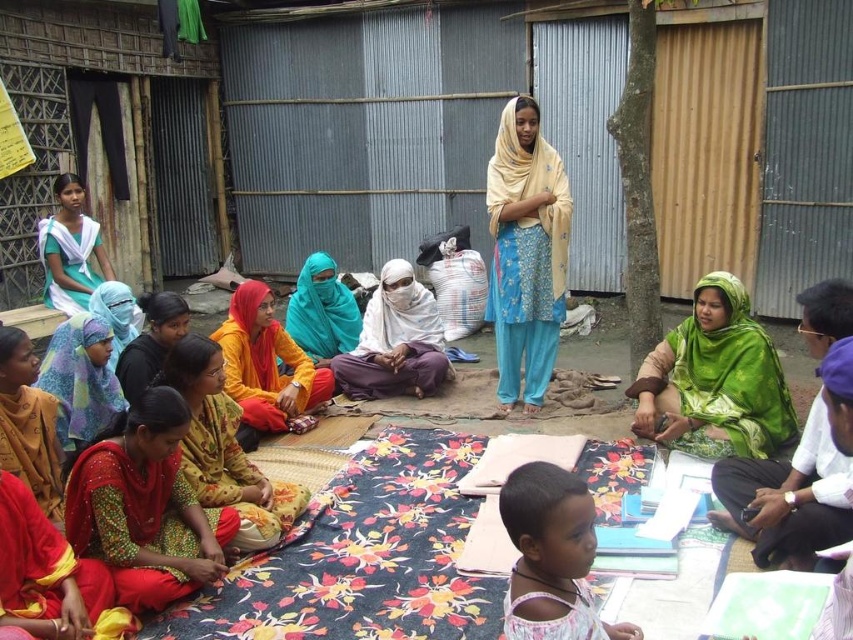
Is matte orange dress at center positioned before matte blue scarf at lower left?

No.

Can you confirm if matte orange dress at center is positioned below matte blue scarf at lower left?

Actually, matte orange dress at center is above matte blue scarf at lower left.

This screenshot has width=853, height=640. Describe the element at coordinates (265, 362) in the screenshot. I see `matte orange dress at center` at that location.

Where is `matte orange dress at center`? matte orange dress at center is located at coordinates (265, 362).

This screenshot has width=853, height=640. In order to click on red fabric saree at lower left in this screenshot , I will do `click(144, 508)`.

Looking at this image, does red fabric saree at lower left have a smaller size compared to printed fabric dress at center?

Yes, red fabric saree at lower left is smaller than printed fabric dress at center.

Locate an element on the screen. This screenshot has height=640, width=853. red fabric saree at lower left is located at coordinates (144, 508).

Between blue printed dress at center and light pink fabric at lower center, which one appears on the right side from the viewer's perspective?

blue printed dress at center is more to the right.

Does blue printed dress at center come in front of light pink fabric at lower center?

No.

Is point (560, 220) less distant than point (587, 621)?

That is False.

Identify the location of blue printed dress at center. The height and width of the screenshot is (640, 853). (526, 252).